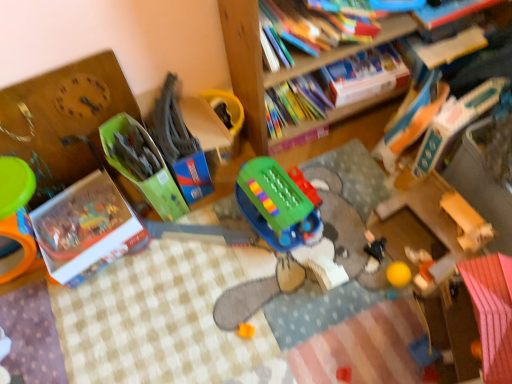
Find the location of a particular element. This screenshot has width=512, height=384. vacant space in front of green cardboard box at center, the sixth toy viewed from the right is located at coordinates (173, 257).